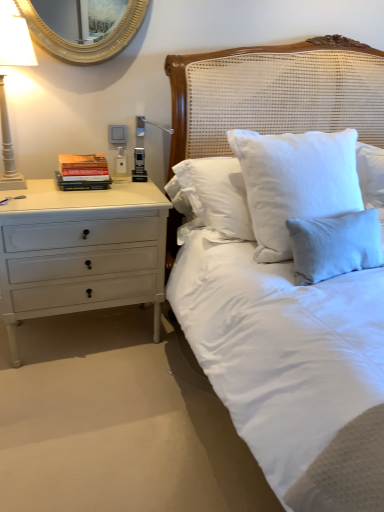
Find the location of `vacant space to the left of hardcover books at left`. vacant space to the left of hardcover books at left is located at coordinates (42, 184).